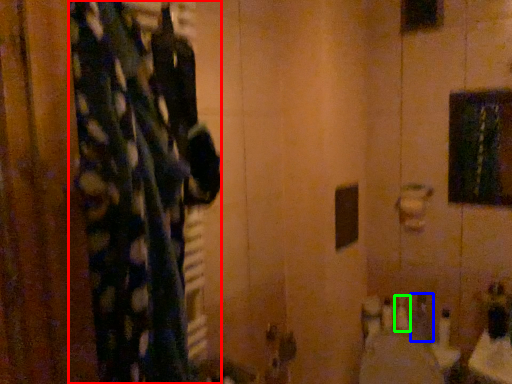
Question: Based on their relative distances, which object is nearer to curtain (highlighted by a red box)? Choose from toiletry (highlighted by a blue box) and toiletry (highlighted by a green box).

Choices:
 (A) toiletry
 (B) toiletry

Answer: (A)